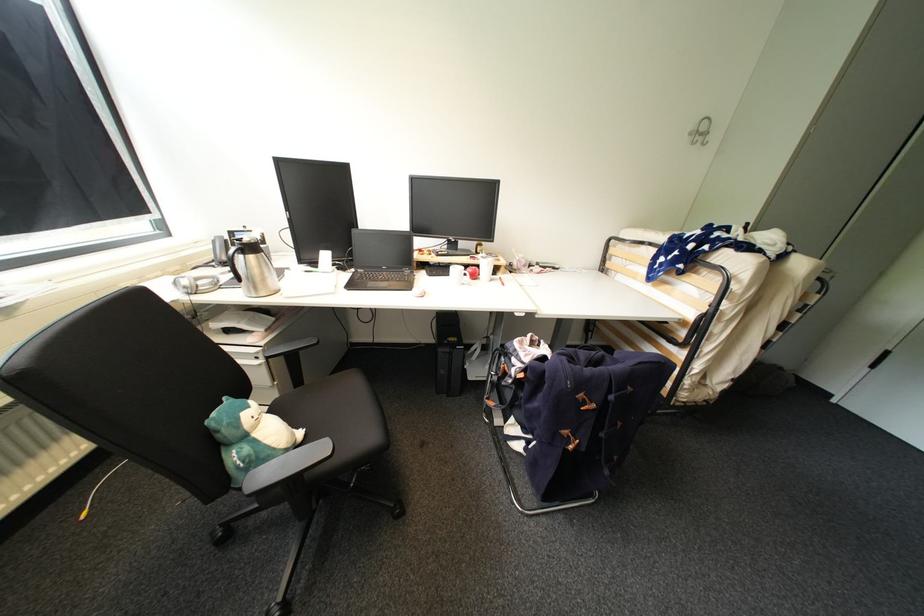
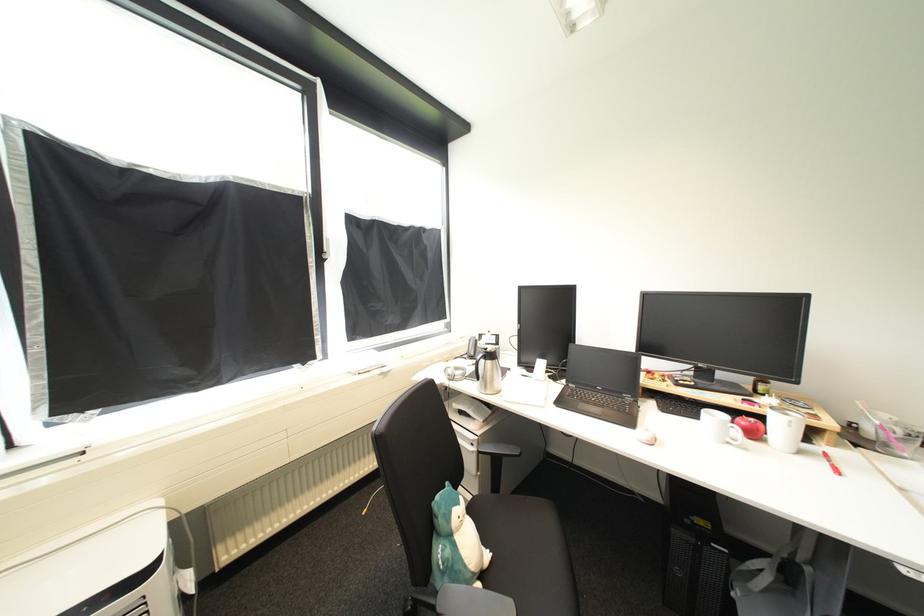
The point at (469, 285) is marked in the first image. Where is the corresponding point in the second image?

(736, 445)